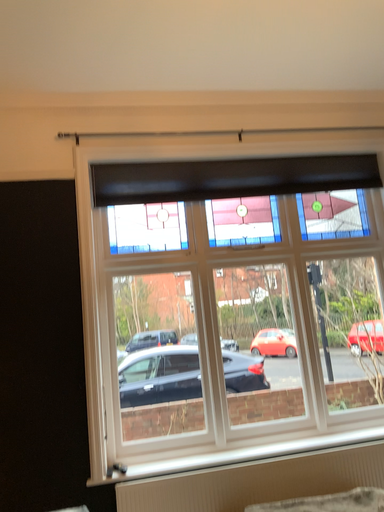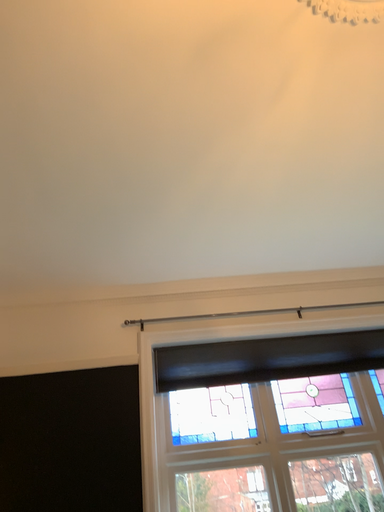
Question: Which way did the camera rotate in the video?

Choices:
 (A) rotated downward
 (B) rotated upward

Answer: (B)